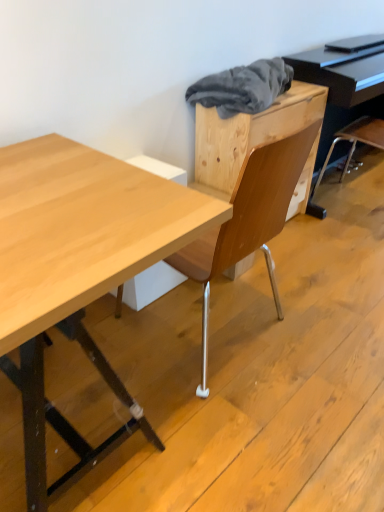
The width and height of the screenshot is (384, 512). Describe the element at coordinates (345, 71) in the screenshot. I see `black glossy piano at upper right` at that location.

What do you see at coordinates (77, 251) in the screenshot? I see `natural wood desk at center` at bounding box center [77, 251].

Image resolution: width=384 pixels, height=512 pixels. In order to click on gray fabric at upper center in this screenshot , I will do `click(242, 87)`.

Identify the location of black glossy piano at upper right. (345, 71).

In the scene shown: From a real-world perspective, is black glossy piano at upper right physically above natural wood desk at center?

Yes, from a real-world perspective, black glossy piano at upper right is above natural wood desk at center.

Between black glossy piano at upper right and natural wood desk at center, which one has larger width?

With larger width is natural wood desk at center.

Is black glossy piano at upper right not within natural wood desk at center?

Indeed, black glossy piano at upper right is completely outside natural wood desk at center.

Is black glossy piano at upper right next to natural wood desk at center and touching it?

No, black glossy piano at upper right is not in contact with natural wood desk at center.

Is gray fabric at upper center aimed at natural wood desk at center?

No, gray fabric at upper center is not oriented towards natural wood desk at center.

Is gray fabric at upper center beside natural wood desk at center?

No, gray fabric at upper center is not in contact with natural wood desk at center.

Considering the relative positions of gray fabric at upper center and natural wood desk at center in the image provided, is gray fabric at upper center to the left of natural wood desk at center from the viewer's perspective?

Yes, gray fabric at upper center is to the left of natural wood desk at center.

From a real-world perspective, does gray fabric at upper center sit lower than natural wood desk at center?

No, from a real-world perspective, gray fabric at upper center is not under natural wood desk at center.

Looking at the image, does natural wood desk at center seem bigger or smaller compared to gray fabric at upper center?

natural wood desk at center is bigger than gray fabric at upper center.

Is natural wood desk at center outside of gray fabric at upper center?

Yes.

Considering the points (53, 136) and (256, 61), which point is in front, point (53, 136) or point (256, 61)?

The point (53, 136) is closer.

Is point (354, 104) less distant than point (279, 90)?

No, it is behind (279, 90).

Who is shorter, black glossy piano at upper right or gray fabric at upper center?

With less height is gray fabric at upper center.

Is black glossy piano at upper right next to gray fabric at upper center and touching it?

No, black glossy piano at upper right is not with gray fabric at upper center.

From the picture: From a real-world perspective, which object rests below the other?

natural wood desk at center.

Considering the points (128, 166) and (379, 51), which point is behind, point (128, 166) or point (379, 51)?

Positioned behind is point (379, 51).

Measure the distance between natural wood desk at center and black glossy piano at upper right.

5.30 feet.

From the picture: From the image's perspective, does gray fabric at upper center appear lower than black glossy piano at upper right?

Incorrect, from the image's perspective, gray fabric at upper center is higher than black glossy piano at upper right.

Considering their positions, is gray fabric at upper center located in front of or behind black glossy piano at upper right?

Clearly, gray fabric at upper center is in front of black glossy piano at upper right.

Considering the positions of objects gray fabric at upper center and black glossy piano at upper right in the image provided, who is more to the right, gray fabric at upper center or black glossy piano at upper right?

Positioned to the right is black glossy piano at upper right.

This screenshot has height=512, width=384. What are the coordinates of `piano located above the natural wood desk at center (from the image's perspective)` in the screenshot? It's located at (345, 71).

The height and width of the screenshot is (512, 384). I want to click on desk on the right side of gray fabric at upper center, so click(x=77, y=251).

Based on their spatial positions, is gray fabric at upper center or black glossy piano at upper right closer to natural wood desk at center?

Based on the image, gray fabric at upper center appears to be nearer to natural wood desk at center.

Based on their spatial positions, is black glossy piano at upper right or natural wood desk at center closer to gray fabric at upper center?

black glossy piano at upper right is positioned closer to the anchor gray fabric at upper center.

Looking at the image, which one is located closer to gray fabric at upper center, natural wood desk at center or black glossy piano at upper right?

black glossy piano at upper right is positioned closer to the anchor gray fabric at upper center.

From the image, which object appears to be nearer to black glossy piano at upper right, gray fabric at upper center or natural wood desk at center?

gray fabric at upper center lies closer to black glossy piano at upper right than the other object.

Estimate the real-world distances between objects in this image. Which object is further from natural wood desk at center, black glossy piano at upper right or gray fabric at upper center?

black glossy piano at upper right is positioned further to the anchor natural wood desk at center.

Which object lies further to the anchor point black glossy piano at upper right, natural wood desk at center or gray fabric at upper center?

Based on the image, natural wood desk at center appears to be further to black glossy piano at upper right.

Locate an element on the screen. The width and height of the screenshot is (384, 512). material between natural wood desk at center and black glossy piano at upper right from front to back is located at coordinates (242, 87).